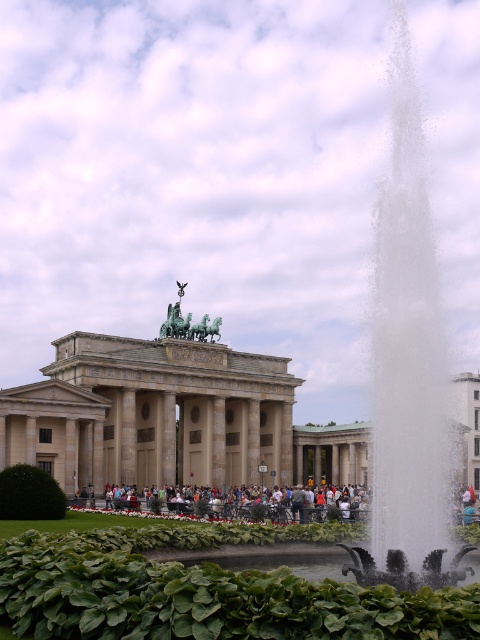
Does light gray concrete people at center appear under green polished stone sculpture at center?

Yes.

What do you see at coordinates (253, 509) in the screenshot?
I see `light gray concrete people at center` at bounding box center [253, 509].

Locate an element on the screen. The image size is (480, 640). light gray concrete people at center is located at coordinates (253, 509).

Between point (464, 465) and point (359, 506), which one is positioned in front?

Point (359, 506)

Find the location of `stone classical building at center`. stone classical building at center is located at coordinates (170, 419).

Is point (232, 449) positioned before point (225, 516)?

That is False.

Identify the location of stone classical building at center. (170, 419).

Does point (444, 580) come behind point (241, 513)?

No, (444, 580) is closer to viewer.

Where is `white frothy water at right`? white frothy water at right is located at coordinates (408, 365).